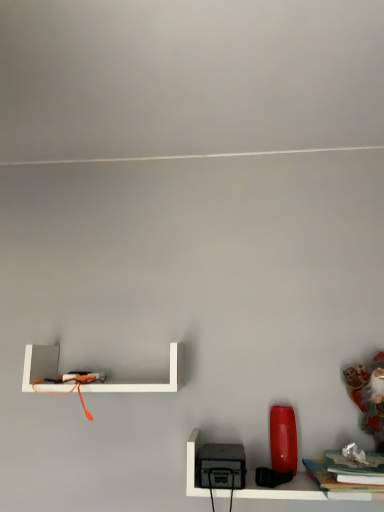
Where is `white matte shelf at upper left, the 2th shelf ordered from the bottom`? The image size is (384, 512). white matte shelf at upper left, the 2th shelf ordered from the bottom is located at coordinates (149, 383).

Identify the location of hardcover book at lower right. (341, 484).

Locate an element on the screen. This screenshot has width=384, height=512. white matte shelf at upper left, the second shelf in the right-to-left sequence is located at coordinates (149, 383).

Which of these two, white matte shelf at upper left, the 2th shelf ordered from the bottom, or velvet santa at right, stands taller?

With more height is velvet santa at right.

Looking at this image, which object is more forward, white matte shelf at upper left, the 2th shelf ordered from the bottom, or velvet santa at right?

velvet santa at right is in front.

Is point (93, 385) positioned before point (357, 388)?

Yes, it is.

Which is behind, point (354, 368) or point (346, 487)?

Positioned behind is point (354, 368).

Is velvet santa at right positioned beyond the bounds of hardcover book at lower right?

velvet santa at right lies outside hardcover book at lower right's area.

Between velvet santa at right and hardcover book at lower right, which one is positioned in front?

hardcover book at lower right is more forward.

At what (x,y) coordinates should I click in order to perform the action: click on toy above the hardcover book at lower right (from the image's perspective). Please return your answer as a coordinate pair (x, y). Image resolution: width=384 pixels, height=512 pixels. Looking at the image, I should click on (367, 398).

Is velvet santa at right positioned beyond the bounds of matte black toaster at lower right, the 2th shelf positioned from the top?

velvet santa at right is positioned outside matte black toaster at lower right, the 2th shelf positioned from the top.

Is velvet santa at right oriented towards matte black toaster at lower right, which is counted as the first shelf, starting from the bottom?

No, velvet santa at right is not facing towards matte black toaster at lower right, which is counted as the first shelf, starting from the bottom.

Does point (348, 391) come farther from viewer compared to point (309, 498)?

Yes, point (348, 391) is farther from viewer.

Who is taller, matte black toaster at lower right, the first shelf from the right, or hardcover book at lower right?

matte black toaster at lower right, the first shelf from the right, is taller.

This screenshot has width=384, height=512. I want to click on book on the right side of matte black toaster at lower right, which is counted as the first shelf, starting from the bottom, so click(341, 484).

From the image's perspective, is matte black toaster at lower right, which is counted as the first shelf, starting from the bottom, located beneath hardcover book at lower right?

Actually, matte black toaster at lower right, which is counted as the first shelf, starting from the bottom, appears above hardcover book at lower right in the image.

Is matte black toaster at lower right, which is counted as the first shelf, starting from the bottom, looking in the opposite direction of hardcover book at lower right?

Yes.

From the image's perspective, which one is positioned lower, matte black toaster at lower right, the 2th shelf positioned from the left, or white matte shelf at upper left, marked as the 1th shelf in a left-to-right arrangement?

matte black toaster at lower right, the 2th shelf positioned from the left, from the image's perspective.

Is matte black toaster at lower right, the 2th shelf positioned from the left, closer to the viewer compared to white matte shelf at upper left, the second shelf in the right-to-left sequence?

Yes, it is.

Which point is more distant from viewer, (263,490) or (85,384)?

The point (85,384) is behind.

Considering the relative sizes of matte black toaster at lower right, which is counted as the first shelf, starting from the bottom, and white matte shelf at upper left, marked as the 1th shelf in a left-to-right arrangement, in the image provided, is matte black toaster at lower right, which is counted as the first shelf, starting from the bottom, taller than white matte shelf at upper left, marked as the 1th shelf in a left-to-right arrangement,?

In fact, matte black toaster at lower right, which is counted as the first shelf, starting from the bottom, may be shorter than white matte shelf at upper left, marked as the 1th shelf in a left-to-right arrangement.

In terms of size, does velvet santa at right appear bigger or smaller than white matte shelf at upper left, the second shelf in the right-to-left sequence?

velvet santa at right is smaller than white matte shelf at upper left, the second shelf in the right-to-left sequence.

Are velvet santa at right and white matte shelf at upper left, the 2th shelf ordered from the bottom, located far from each other?

No, velvet santa at right is not far away from white matte shelf at upper left, the 2th shelf ordered from the bottom.

Is velvet santa at right looking in the opposite direction of white matte shelf at upper left, which is the first shelf from top to bottom?

No, velvet santa at right is not facing away from white matte shelf at upper left, which is the first shelf from top to bottom.

From a real-world perspective, which object rests below the other?

velvet santa at right.

From the image's perspective, between white matte shelf at upper left, the 2th shelf ordered from the bottom, and hardcover book at lower right, which one is located above?

white matte shelf at upper left, the 2th shelf ordered from the bottom, is shown above in the image.

Considering the positions of point (122, 388) and point (362, 500), is point (122, 388) closer or farther from the camera than point (362, 500)?

Point (122, 388) appears to be farther away from the viewer than point (362, 500).

Is white matte shelf at upper left, the second shelf in the right-to-left sequence, behind hardcover book at lower right?

Yes.

Which object is positioned more to the right, white matte shelf at upper left, the second shelf in the right-to-left sequence, or hardcover book at lower right?

Positioned to the right is hardcover book at lower right.

Identify the location of toy lying below the white matte shelf at upper left, marked as the 1th shelf in a left-to-right arrangement (from the image's perspective). (367, 398).

Find the location of a particular element. This screenshot has height=512, width=384. book on the left of velvet santa at right is located at coordinates (341, 484).

Which object lies nearer to the anchor point white matte shelf at upper left, the second shelf in the right-to-left sequence, hardcover book at lower right or velvet santa at right?

hardcover book at lower right lies closer to white matte shelf at upper left, the second shelf in the right-to-left sequence, than the other object.

Which object lies further to the anchor point hardcover book at lower right, white matte shelf at upper left, the second shelf in the right-to-left sequence, or velvet santa at right?

white matte shelf at upper left, the second shelf in the right-to-left sequence, is further to hardcover book at lower right.

From the image, which object appears to be nearer to matte black toaster at lower right, the 2th shelf positioned from the left, white matte shelf at upper left, the 2th shelf ordered from the bottom, or hardcover book at lower right?

Based on the image, hardcover book at lower right appears to be nearer to matte black toaster at lower right, the 2th shelf positioned from the left.

Looking at the image, which one is located further to matte black toaster at lower right, the 2th shelf positioned from the left, hardcover book at lower right or white matte shelf at upper left, the 2th shelf ordered from the bottom?

Among the two, white matte shelf at upper left, the 2th shelf ordered from the bottom, is located further to matte black toaster at lower right, the 2th shelf positioned from the left.

Which object lies further to the anchor point white matte shelf at upper left, which is the first shelf from top to bottom, velvet santa at right or matte black toaster at lower right, the 2th shelf positioned from the top?

velvet santa at right is further to white matte shelf at upper left, which is the first shelf from top to bottom.

Considering their positions, is velvet santa at right positioned further to white matte shelf at upper left, marked as the 1th shelf in a left-to-right arrangement, than hardcover book at lower right?

The object further to white matte shelf at upper left, marked as the 1th shelf in a left-to-right arrangement, is velvet santa at right.

Based on their spatial positions, is velvet santa at right or white matte shelf at upper left, marked as the 1th shelf in a left-to-right arrangement, further from hardcover book at lower right?

Based on the image, white matte shelf at upper left, marked as the 1th shelf in a left-to-right arrangement, appears to be further to hardcover book at lower right.

From the image, which object appears to be farther from velvet santa at right, white matte shelf at upper left, the second shelf in the right-to-left sequence, or matte black toaster at lower right, the 2th shelf positioned from the left?

Based on the image, white matte shelf at upper left, the second shelf in the right-to-left sequence, appears to be further to velvet santa at right.

Where is `shelf between white matte shelf at upper left, the second shelf in the right-to-left sequence, and velvet santa at right from left to right`? This screenshot has width=384, height=512. shelf between white matte shelf at upper left, the second shelf in the right-to-left sequence, and velvet santa at right from left to right is located at coordinates (309, 489).

Locate an element on the screen. This screenshot has width=384, height=512. book between matte black toaster at lower right, the first shelf from the right, and velvet santa at right from left to right is located at coordinates (341, 484).

The height and width of the screenshot is (512, 384). Find the location of `shelf situated between white matte shelf at upper left, the second shelf in the right-to-left sequence, and hardcover book at lower right from left to right`. shelf situated between white matte shelf at upper left, the second shelf in the right-to-left sequence, and hardcover book at lower right from left to right is located at coordinates (309, 489).

Locate an element on the screen. This screenshot has height=512, width=384. book between white matte shelf at upper left, which is the first shelf from top to bottom, and velvet santa at right, in the horizontal direction is located at coordinates (341, 484).